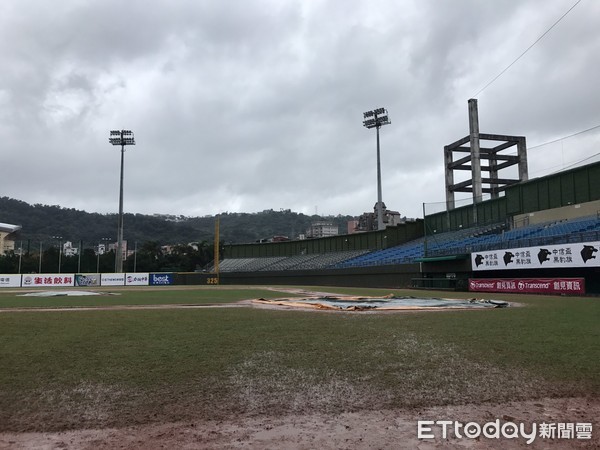
Find the location of `lights`. lights is located at coordinates (373, 122), (372, 109), (120, 139), (116, 130).